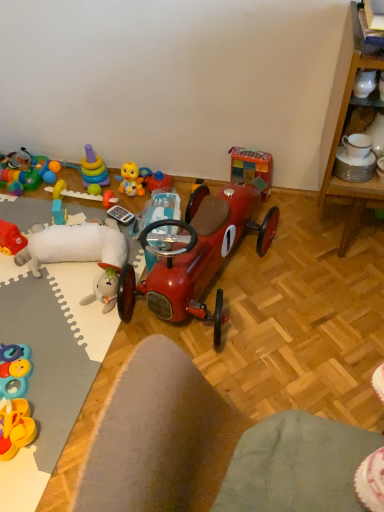
Question: Should I look upward or downward to see translucent plastic block at upper left, the 3th toy positioned from the left?

Choices:
 (A) up
 (B) down

Answer: (A)

Question: Considering the relative sizes of rubberized multicolored ball at left, acting as the 1th toy starting from the left, and shiny red car at center, the second toy from the right, in the image provided, is rubberized multicolored ball at left, acting as the 1th toy starting from the left, taller than shiny red car at center, the second toy from the right,?

Choices:
 (A) no
 (B) yes

Answer: (A)

Question: Can you confirm if rubberized multicolored ball at left, acting as the 1th toy starting from the left, is wider than shiny red car at center, the second toy from the right?

Choices:
 (A) no
 (B) yes

Answer: (A)

Question: From the image's perspective, is rubberized multicolored ball at left, acting as the 1th toy starting from the left, on shiny red car at center, which is the 10th toy in left-to-right order?

Choices:
 (A) no
 (B) yes

Answer: (B)

Question: Is rubberized multicolored ball at left, acting as the 1th toy starting from the left, oriented towards shiny red car at center, the second toy from the right?

Choices:
 (A) yes
 (B) no

Answer: (B)

Question: Is rubberized multicolored ball at left, acting as the 1th toy starting from the left, turned away from shiny red car at center, the second toy from the right?

Choices:
 (A) yes
 (B) no

Answer: (B)

Question: Can you confirm if rubberized multicolored ball at left, which is counted as the 11th toy, starting from the right, is smaller than shiny red car at center, the second toy from the right?

Choices:
 (A) no
 (B) yes

Answer: (B)

Question: Would you consider rubberized multicolored ball at left, which is counted as the 11th toy, starting from the right, to be distant from matte plastic desk at center?

Choices:
 (A) yes
 (B) no

Answer: (A)

Question: Is rubberized multicolored ball at left, acting as the 1th toy starting from the left, smaller than matte plastic desk at center?

Choices:
 (A) yes
 (B) no

Answer: (A)

Question: Considering the relative sizes of rubberized multicolored ball at left, which is counted as the 11th toy, starting from the right, and matte plastic desk at center in the image provided, is rubberized multicolored ball at left, which is counted as the 11th toy, starting from the right, thinner than matte plastic desk at center?

Choices:
 (A) no
 (B) yes

Answer: (B)

Question: Can you confirm if rubberized multicolored ball at left, acting as the 1th toy starting from the left, is taller than matte plastic desk at center?

Choices:
 (A) yes
 (B) no

Answer: (B)

Question: Can you confirm if rubberized multicolored ball at left, acting as the 1th toy starting from the left, is bigger than matte plastic desk at center?

Choices:
 (A) yes
 (B) no

Answer: (B)

Question: Does rubberized multicolored ball at left, acting as the 1th toy starting from the left, lie behind matte plastic desk at center?

Choices:
 (A) yes
 (B) no

Answer: (A)

Question: Is translucent plastic block at upper left, which is the 9th toy in right-to-left order, not inside shiny red car at center, the second toy from the right?

Choices:
 (A) no
 (B) yes

Answer: (B)